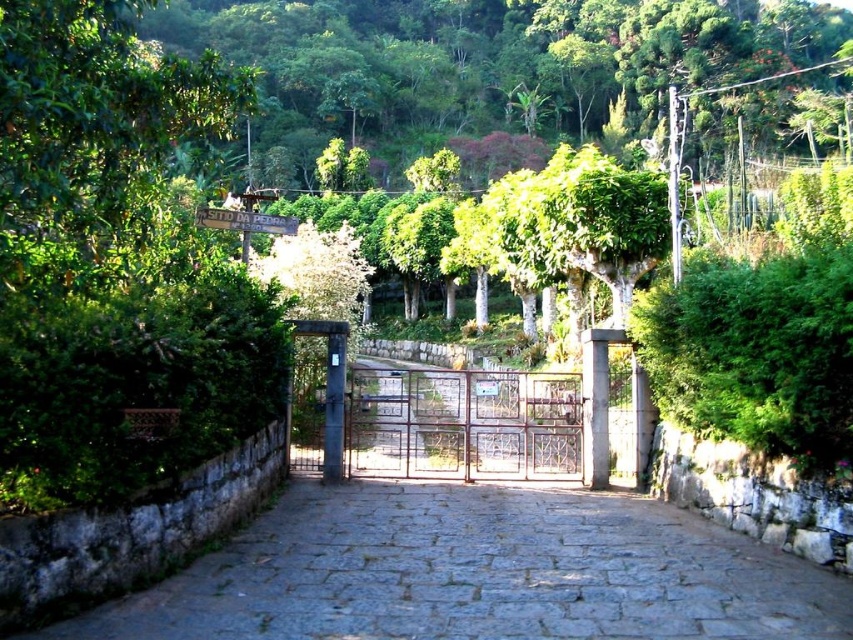
Question: Is gray stone path at center closer to the viewer compared to metallic gate at center?

Choices:
 (A) yes
 (B) no

Answer: (A)

Question: Does gray stone path at center lie in front of metallic gate at center?

Choices:
 (A) yes
 (B) no

Answer: (A)

Question: In this image, where is metallic gate at center located relative to metal gate at center?

Choices:
 (A) left
 (B) right

Answer: (B)

Question: Which of the following is the closest to the observer?

Choices:
 (A) (471, 385)
 (B) (334, 385)

Answer: (B)

Question: Among these objects, which one is nearest to the camera?

Choices:
 (A) metal gate at center
 (B) gray stone path at center
 (C) metallic gate at center

Answer: (B)

Question: Which point is closer to the camera?

Choices:
 (A) (331, 348)
 (B) (352, 458)

Answer: (A)